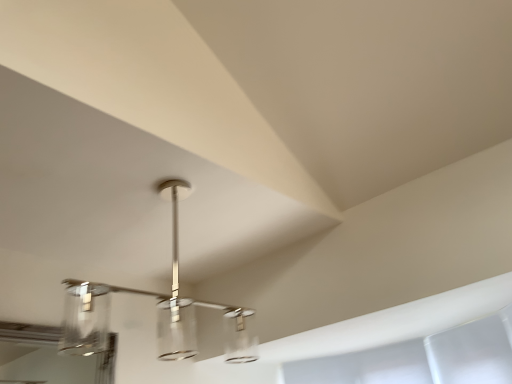
Locate an element on the screen. The height and width of the screenshot is (384, 512). polished chrome chandelier at center is located at coordinates (157, 310).

This screenshot has width=512, height=384. Describe the element at coordinates (157, 310) in the screenshot. I see `polished chrome chandelier at center` at that location.

You are a GUI agent. You are given a task and a screenshot of the screen. Output one action in this format:
    pyautogui.click(x=<x>, y=<y>)
    Task: Click on the polished chrome chandelier at center
    The height and width of the screenshot is (384, 512).
    Given the screenshot: What is the action you would take?
    pyautogui.click(x=157, y=310)